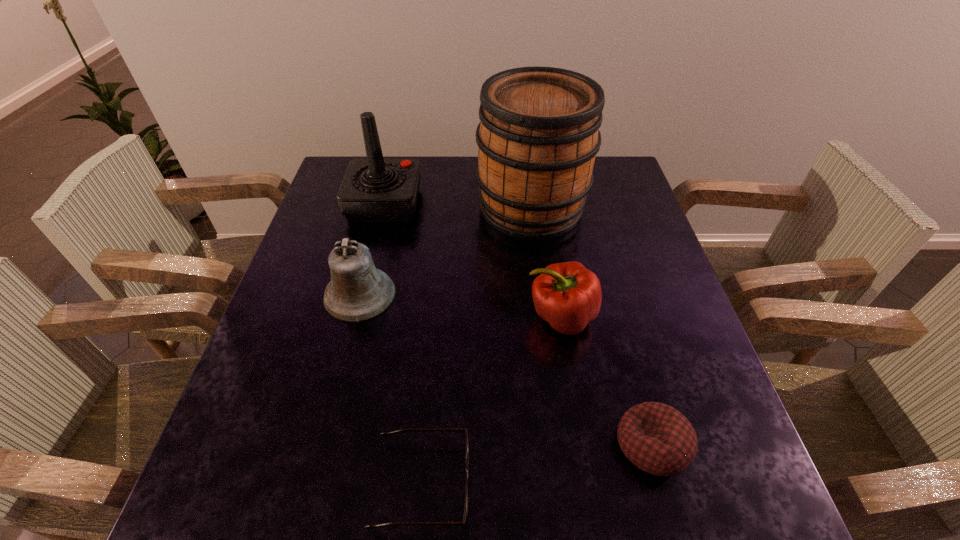
Where is `vacant space located 0.320m on the left of the bell pepper`? This screenshot has width=960, height=540. vacant space located 0.320m on the left of the bell pepper is located at coordinates (383, 318).

Where is `free location located 0.140m on the left of the beanbag`? free location located 0.140m on the left of the beanbag is located at coordinates (538, 445).

Where is `vacant region located 0.370m on the front lenses of the third object from left to right`? Image resolution: width=960 pixels, height=540 pixels. vacant region located 0.370m on the front lenses of the third object from left to right is located at coordinates (688, 484).

Identify the location of cider that is at the far edge. The width and height of the screenshot is (960, 540). (538, 136).

This screenshot has width=960, height=540. In order to click on joystick that is at the far edge in this screenshot , I will do `click(375, 190)`.

This screenshot has height=540, width=960. Identify the location of beanbag at the near edge. (657, 438).

The width and height of the screenshot is (960, 540). What are the coordinates of `sunglasses that is at the near edge` in the screenshot? It's located at (384, 434).

Find the location of `joystick present at the left edge`. joystick present at the left edge is located at coordinates point(375,190).

Where is `bell at the left edge`? The image size is (960, 540). bell at the left edge is located at coordinates (358, 291).

At what (x,y) coordinates should I click in order to perform the action: click on cider that is at the right edge. Please return your answer as a coordinate pair (x, y). The image size is (960, 540). Looking at the image, I should click on (538, 136).